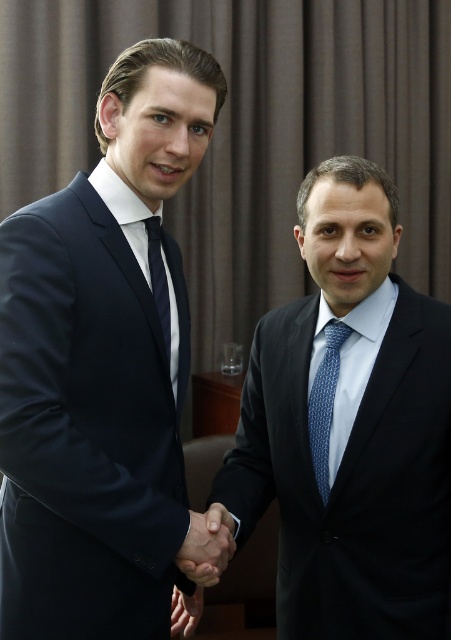
Between navy blue suit at left and black matte hand at center, which one has more height?

Standing taller between the two is navy blue suit at left.

Is navy blue suit at left below black matte hand at center?

No, navy blue suit at left is not below black matte hand at center.

Is point (130, 616) farther from viewer compared to point (199, 547)?

That is True.

What are the coordinates of `navy blue suit at left` in the screenshot? It's located at 101,365.

Between point (312, 396) and point (169, 358), which one is positioned in front?

Point (169, 358) is in front.

Does point (334, 320) lie in front of point (164, 342)?

No, it is not.

Who is more distant from viewer, [326,392] or [155,216]?

Point [326,392]

Where is `blue dotted tie at right`? This screenshot has width=451, height=640. blue dotted tie at right is located at coordinates pyautogui.click(x=325, y=403).

Can you confirm if navy blue suit at left is positioned above black matte suit at center?

Correct, navy blue suit at left is located above black matte suit at center.

Looking at this image, who is positioned more to the right, navy blue suit at left or black matte suit at center?

From the viewer's perspective, black matte suit at center appears more on the right side.

What do you see at coordinates (101, 365) in the screenshot?
I see `navy blue suit at left` at bounding box center [101, 365].

Find the location of a particular element. navy blue suit at left is located at coordinates (101, 365).